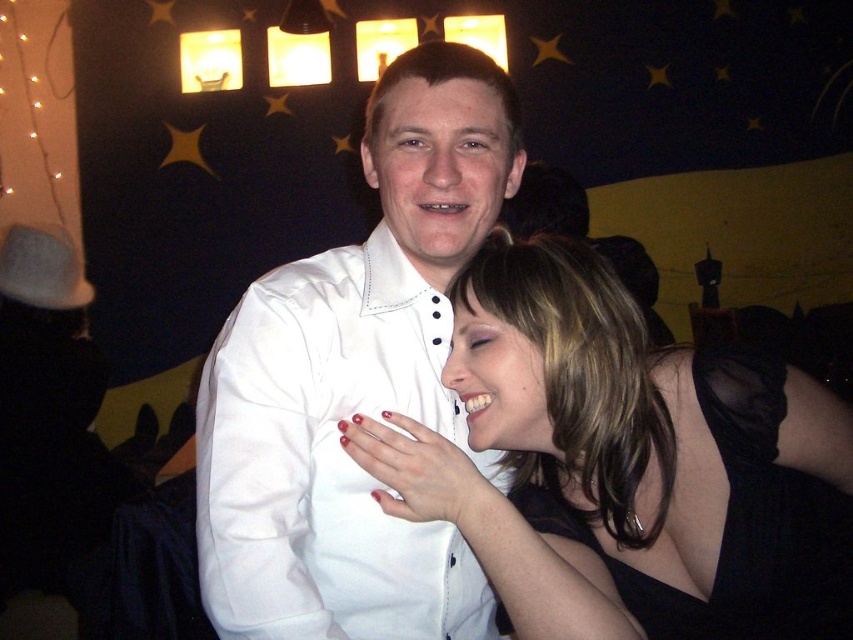
Is point (816, 394) more distant than point (241, 326)?

No, it is not.

Which is behind, point (709, 429) or point (242, 586)?

Positioned behind is point (709, 429).

Between point (608, 465) and point (228, 584), which one is positioned behind?

Point (608, 465)

Find the location of a particular element. satin black dress at center is located at coordinates pos(624,465).

Is satin black dress at center bigger than black satin dress at lower right?

Indeed, satin black dress at center has a larger size compared to black satin dress at lower right.

Can you confirm if satin black dress at center is positioned to the right of black satin dress at lower right?

In fact, satin black dress at center is to the left of black satin dress at lower right.

Which is behind, point (636, 502) or point (773, 611)?

The point (636, 502) is more distant.

You are a GUI agent. You are given a task and a screenshot of the screen. Output one action in this format:
    pyautogui.click(x=<x>, y=<y>)
    Task: Click on the satin black dress at center
    The width and height of the screenshot is (853, 640).
    Given the screenshot: What is the action you would take?
    pos(624,465)

What do you see at coordinates (355, 381) in the screenshot? I see `white satin shirt at center` at bounding box center [355, 381].

Who is more forward, (363, 384) or (688, 637)?

Point (688, 637) is in front.

At what (x,y) coordinates should I click in order to perform the action: click on white satin shirt at center. Please return your answer as a coordinate pair (x, y). Looking at the image, I should click on (355, 381).